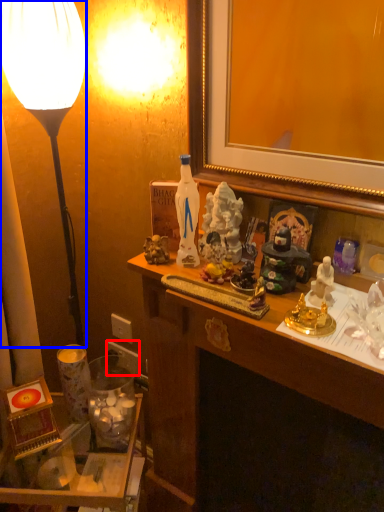
Question: Which of the following is the closest to the observer, power outlet (highlighted by a red box) or lamp (highlighted by a blue box)?

Choices:
 (A) power outlet
 (B) lamp

Answer: (B)